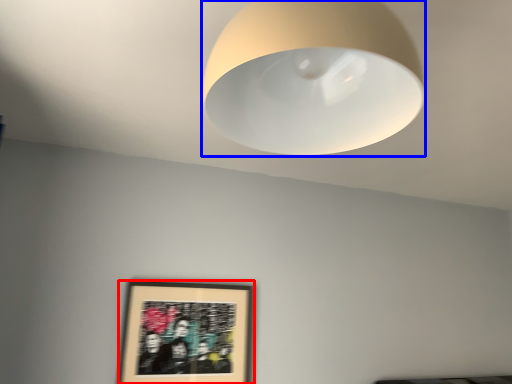
Question: Which object is further to the camera taking this photo, picture frame (highlighted by a red box) or lamp (highlighted by a blue box)?

Choices:
 (A) picture frame
 (B) lamp

Answer: (A)